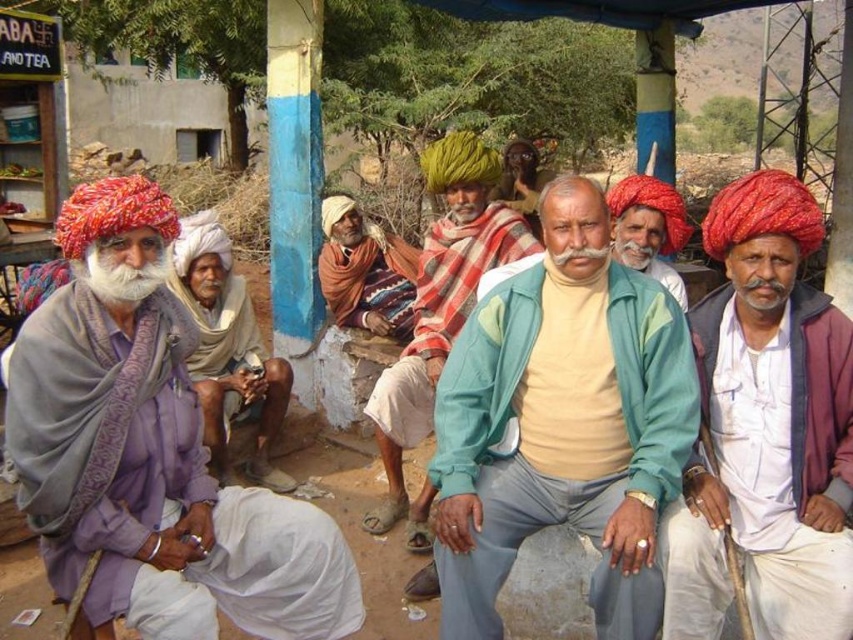
You are standing at the position of point (108, 276) and want to walk towards the blue pillar behind you. There is a point at (428, 496) which is an obstacle. Can you reach the blue pillar without going around the obstacle?

Point (428, 496) is behind point (108, 276), so the obstacle is between you and the blue pillar. You will need to go around the obstacle to reach the blue pillar.

You are a photographer standing at the center of the image. You want to take a closeup shot of the matte red turban at right. Based on its coordinates, which direction should you move to get closer to it?

The matte red turban at right is located at coordinates point (766, 428). Since you are at the center, you should move towards the right and slightly upwards to reach its position.

You are standing in front of the shelter and want to place a small decoration between the two points, point [784,637] and point [256,340]. Which point should the decoration be closer to in order to be nearer to you?

The decoration should be closer to point [784,637] because it is nearer to the viewer than point [256,340].